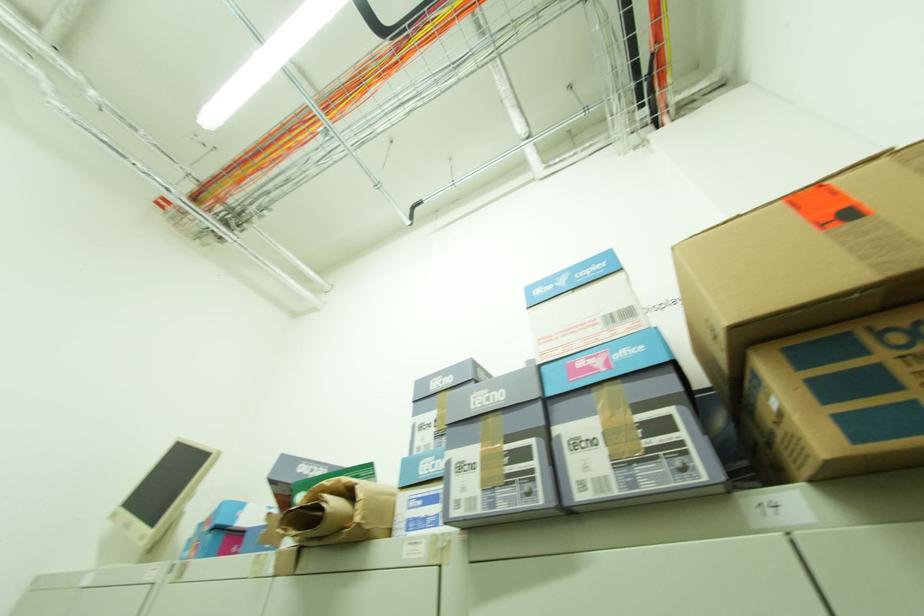
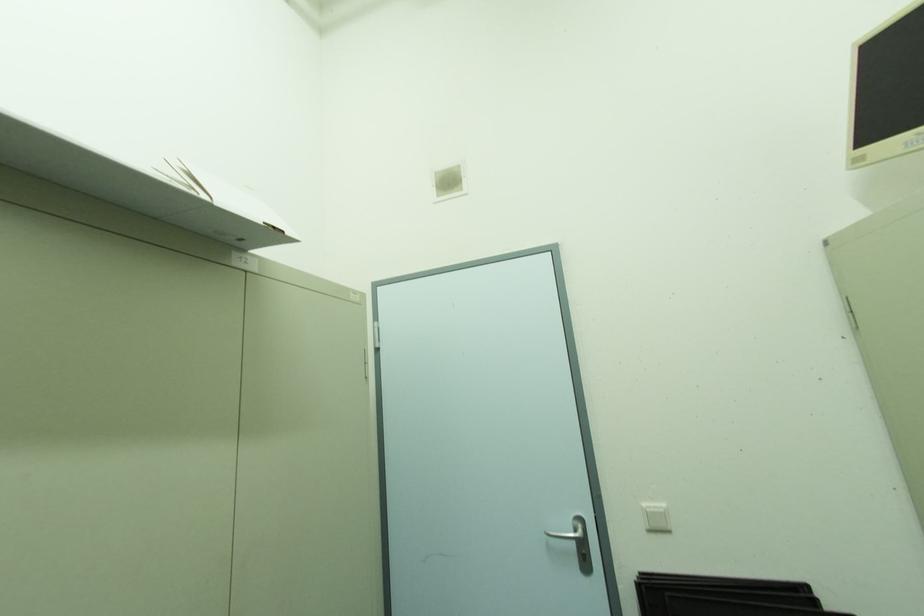
Question: How did the camera likely rotate?

Choices:
 (A) Left
 (B) Right
 (C) Up
 (D) Down

Answer: (A)